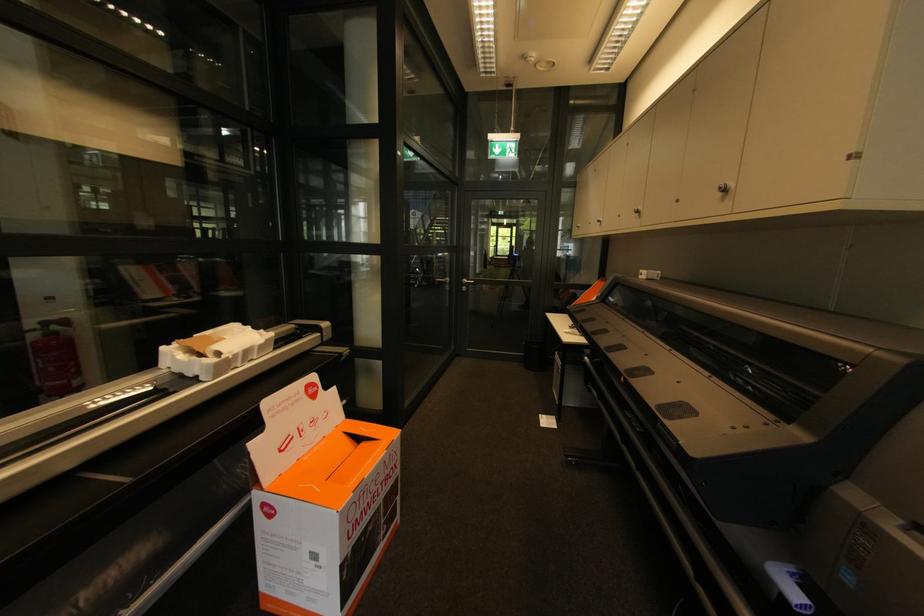
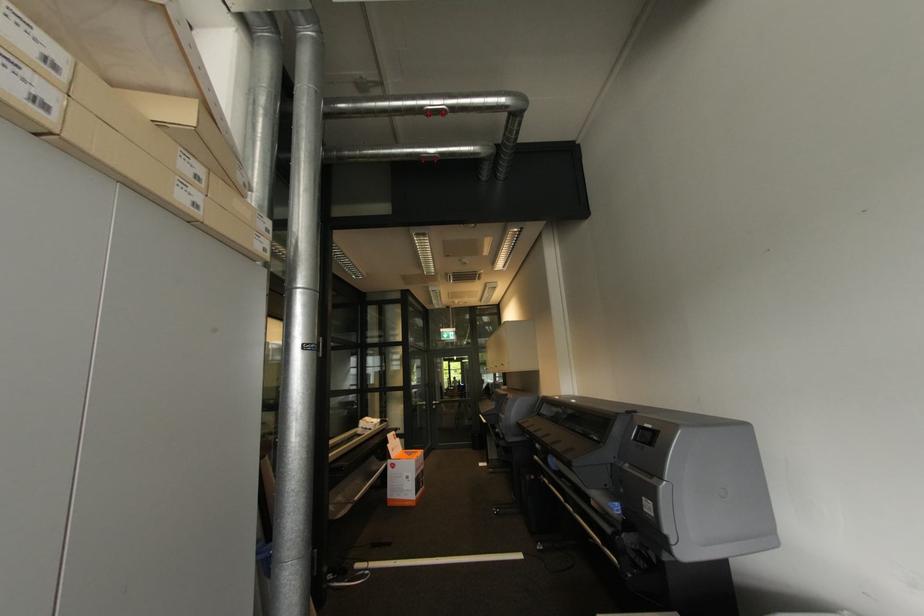
Question: In a continuous first-person perspective shot, in which direction is the camera moving?

Choices:
 (A) Left
 (B) Right
 (C) Forward
 (D) Backward

Answer: (D)